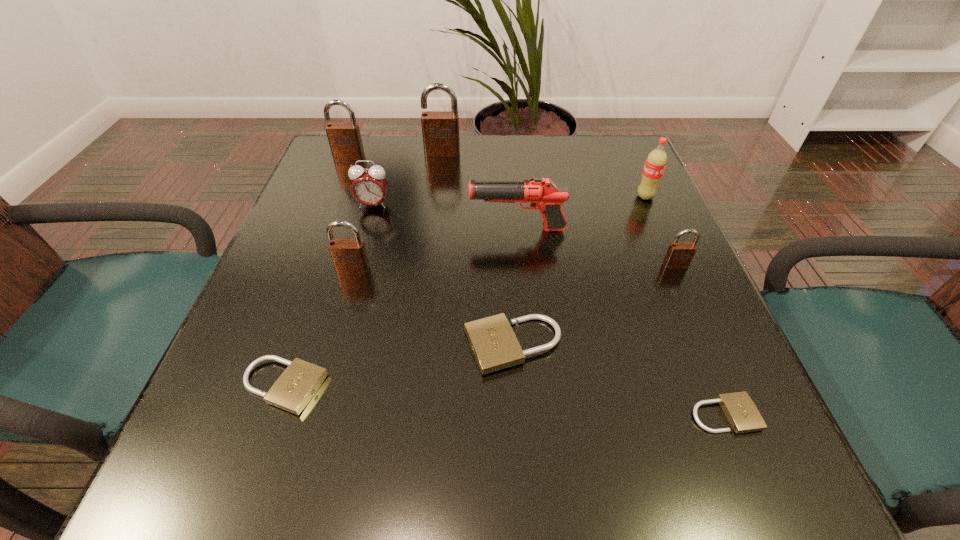
Image resolution: width=960 pixels, height=540 pixels. What are the coordinates of `object at the near edge` in the screenshot? It's located at (742, 414).

Where is `alarm clock that is at the left edge`? This screenshot has width=960, height=540. alarm clock that is at the left edge is located at coordinates (369, 186).

Where is `soda at the right edge`? soda at the right edge is located at coordinates (655, 163).

The width and height of the screenshot is (960, 540). What are the coordinates of `object located in the far left corner section of the desktop` in the screenshot? It's located at (345, 141).

Where is `object that is at the near right corner`? object that is at the near right corner is located at coordinates (742, 414).

Find the location of a particular element. blank area at the far edge is located at coordinates (437, 158).

I want to click on vacant area at the left edge, so click(x=314, y=226).

The height and width of the screenshot is (540, 960). In order to click on free region at the right edge of the desktop in this screenshot , I will do `click(652, 243)`.

Image resolution: width=960 pixels, height=540 pixels. Identify the location of vacant space at the far left corner of the desktop. (363, 146).

Identify the location of vacant space at the far right corner. The width and height of the screenshot is (960, 540). (636, 174).